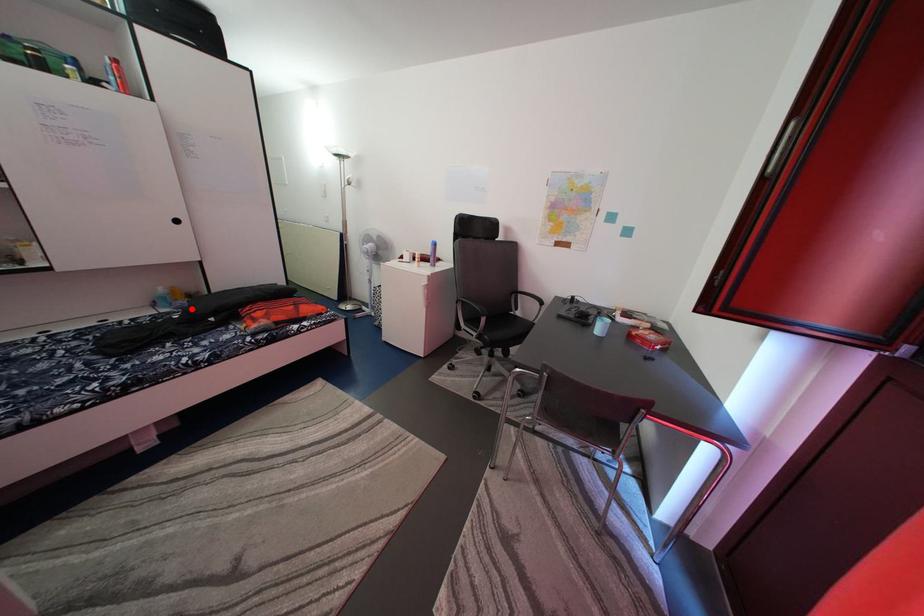
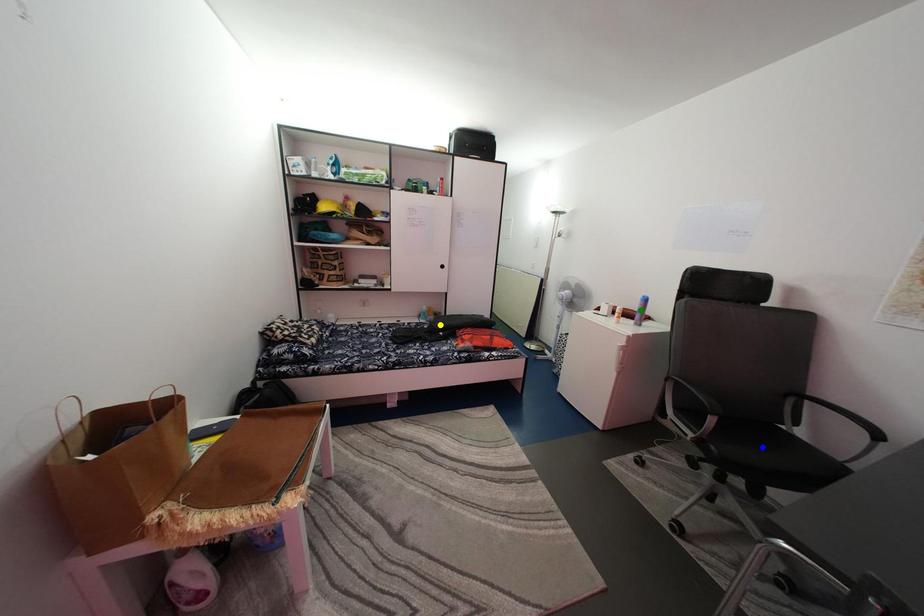
Question: I am providing you with two images of the same scene from different viewpoints. A red point is marked on the first image. You are given multiple points on the second image. In image 2, which mark is for the same physical point as the one in image 1?

Choices:
 (A) yellow point
 (B) green point
 (C) blue point

Answer: (A)